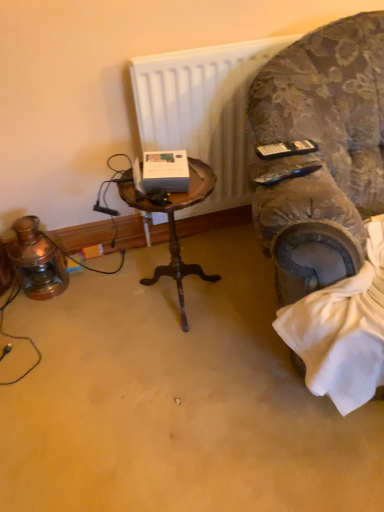
Question: Should I look upward or downward to see white matte radiator at upper center?

Choices:
 (A) down
 (B) up

Answer: (B)

Question: From a real-world perspective, is velvet-patterned armchair at right positioned under woodenobject at center based on gravity?

Choices:
 (A) yes
 (B) no

Answer: (B)

Question: From a real-world perspective, is velvet-patterned armchair at right over woodenobject at center?

Choices:
 (A) no
 (B) yes

Answer: (B)

Question: Is woodenobject at center a part of velvet-patterned armchair at right?

Choices:
 (A) no
 (B) yes

Answer: (A)

Question: Is velvet-patterned armchair at right thinner than woodenobject at center?

Choices:
 (A) yes
 (B) no

Answer: (B)

Question: Does velvet-patterned armchair at right touch woodenobject at center?

Choices:
 (A) no
 (B) yes

Answer: (A)

Question: Is woodenobject at center at the back of velvet-patterned armchair at right?

Choices:
 (A) no
 (B) yes

Answer: (A)

Question: Is woodenobject at center taller than white matte radiator at upper center?

Choices:
 (A) yes
 (B) no

Answer: (B)

Question: From a real-world perspective, is woodenobject at center on top of white matte radiator at upper center?

Choices:
 (A) yes
 (B) no

Answer: (B)

Question: Are woodenobject at center and white matte radiator at upper center far apart?

Choices:
 (A) no
 (B) yes

Answer: (A)

Question: Does woodenobject at center turn towards white matte radiator at upper center?

Choices:
 (A) no
 (B) yes

Answer: (A)

Question: Is woodenobject at center next to white matte radiator at upper center and touching it?

Choices:
 (A) no
 (B) yes

Answer: (A)

Question: Is woodenobject at center facing away from white matte radiator at upper center?

Choices:
 (A) no
 (B) yes

Answer: (B)

Question: Is white matte radiator at upper center shorter than velvet-patterned armchair at right?

Choices:
 (A) yes
 (B) no

Answer: (A)